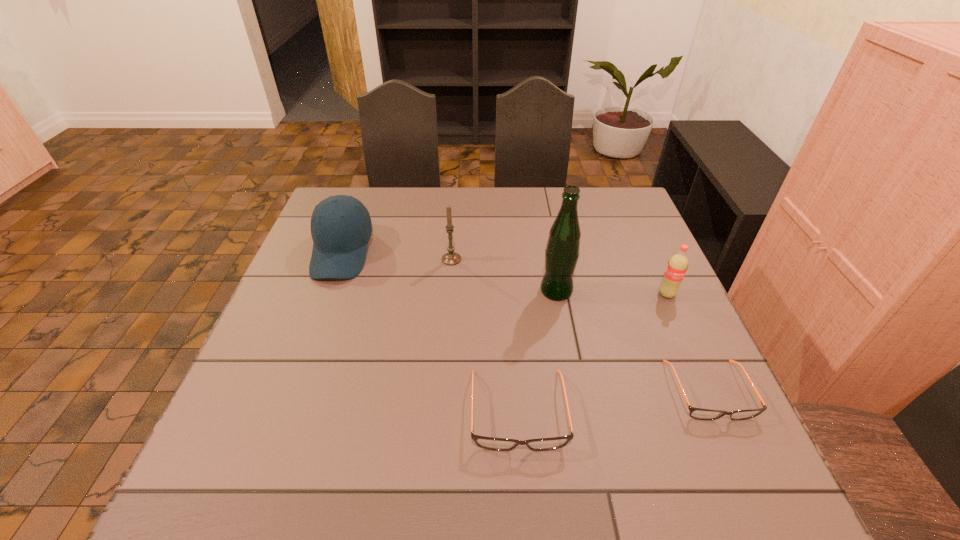
Considering the uniform spacing of spectacless, where should an additional spectacles be positioned on the left? Please locate a free spot. Please provide its 2D coordinates. Your answer should be formatted as a tuple, i.e. [(x, y)], where the tuple contains the x and y coordinates of a point satisfying the conditions above.

[(312, 431)]